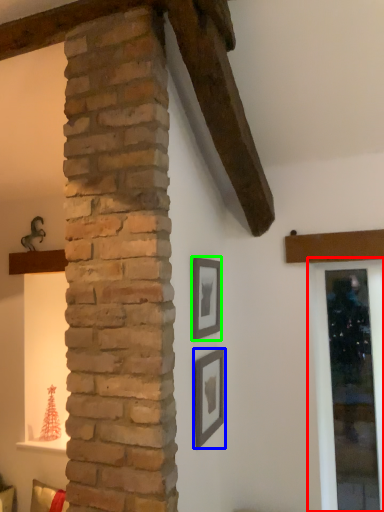
Question: Which is nearer to the window frame (highlighted by a red box)? picture frame (highlighted by a blue box) or picture frame (highlighted by a green box).

Choices:
 (A) picture frame
 (B) picture frame

Answer: (A)